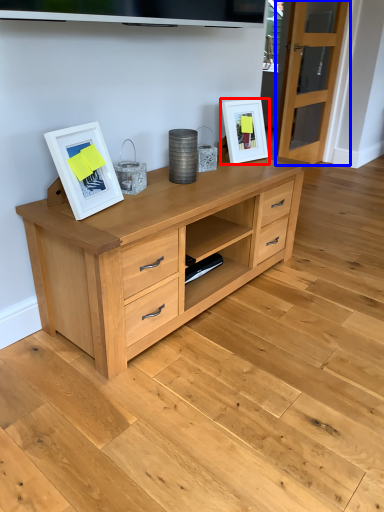
Question: Which object is closer to the camera taking this photo, picture frame (highlighted by a red box) or glass door (highlighted by a blue box)?

Choices:
 (A) picture frame
 (B) glass door

Answer: (A)